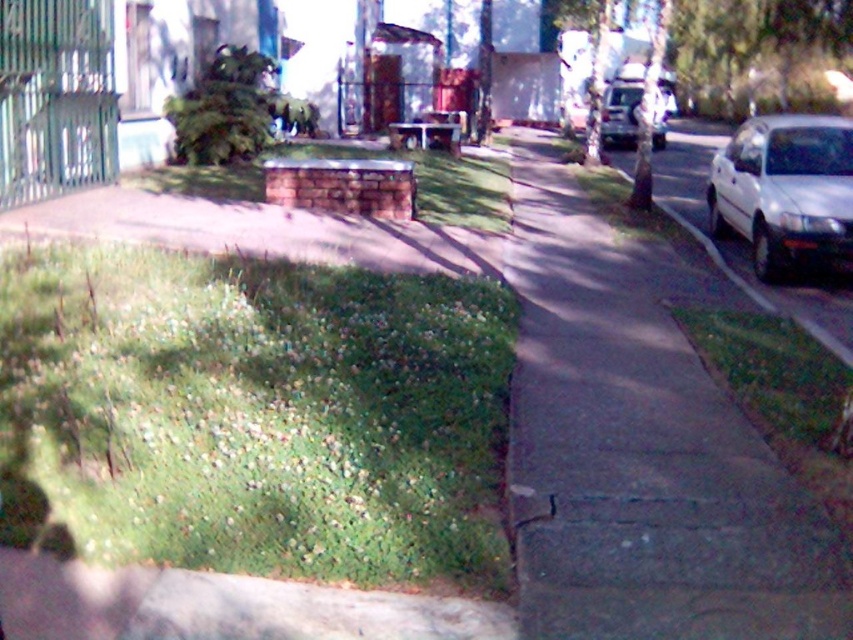
Does point (784, 172) come behind point (813, 412)?

That is True.

Locate an element on the screen. white matte car at right is located at coordinates (785, 192).

Where is `white matte car at right`? This screenshot has height=640, width=853. white matte car at right is located at coordinates (785, 192).

Between green leafy grass at lower left and gray concrete sidewalk at center, which one is positioned higher?

gray concrete sidewalk at center is above.

Between point (389, 445) and point (601, 540), which one is positioned behind?

Point (389, 445)

What are the coordinates of `green leafy grass at lower left` in the screenshot? It's located at (253, 416).

Does green leafy grass at lower left appear over silver metallic van at center?

Incorrect, green leafy grass at lower left is not positioned above silver metallic van at center.

Is the position of green leafy grass at lower left less distant than that of silver metallic van at center?

Yes, it is in front of silver metallic van at center.

Does point (231, 563) lie in front of point (622, 141)?

Yes, point (231, 563) is in front of point (622, 141).

In order to click on green leafy grass at lower left in this screenshot , I will do click(253, 416).